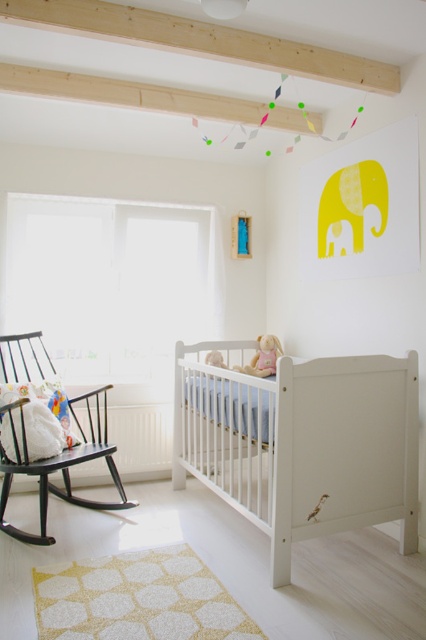
Does point (281, 488) come closer to viewer compared to point (250, 364)?

Yes, it is.

Can you confirm if white wooden crib at center is thinner than soft pink fabric doll at upper center?

No, white wooden crib at center is not thinner than soft pink fabric doll at upper center.

Is point (344, 472) closer to camera compared to point (273, 344)?

Yes, it is.

The width and height of the screenshot is (426, 640). In order to click on white wooden crib at center in this screenshot , I will do `click(302, 444)`.

Is point (253, 369) positioned after point (212, 360)?

That is False.

Find the location of a particular element. soft pink fabric doll at upper center is located at coordinates (264, 356).

Which of these two, black wood rocking chair at left or yellow matte baby elephant at center, stands taller?

With more height is black wood rocking chair at left.

From the picture: Does black wood rocking chair at left have a greater height compared to yellow matte baby elephant at center?

Correct, black wood rocking chair at left is much taller as yellow matte baby elephant at center.

Who is more forward, [46,499] or [221,356]?

Positioned in front is point [46,499].

You are a GUI agent. You are given a task and a screenshot of the screen. Output one action in this format:
    pyautogui.click(x=<x>, y=<y>)
    Task: Click on the black wood rocking chair at left
    
    Given the screenshot: What is the action you would take?
    pyautogui.click(x=58, y=464)